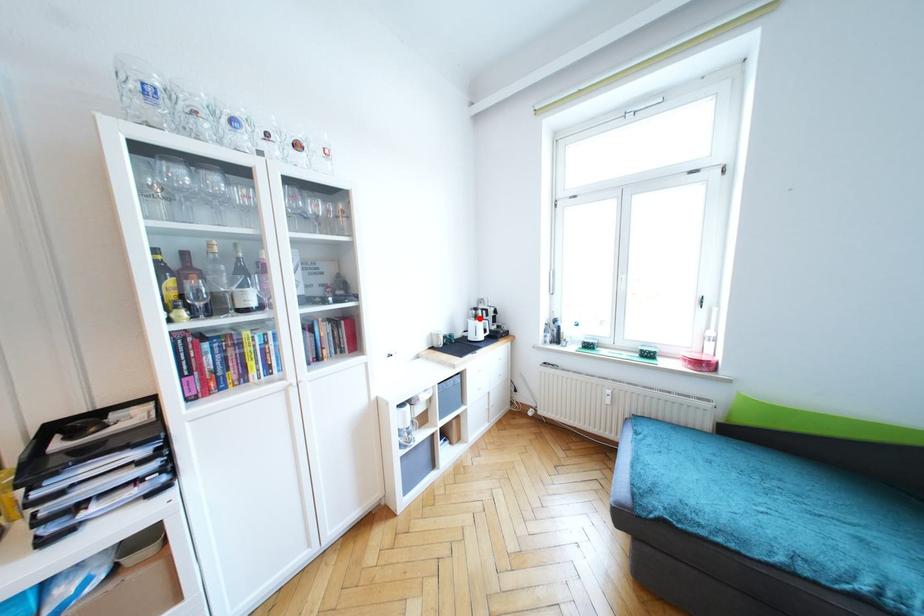
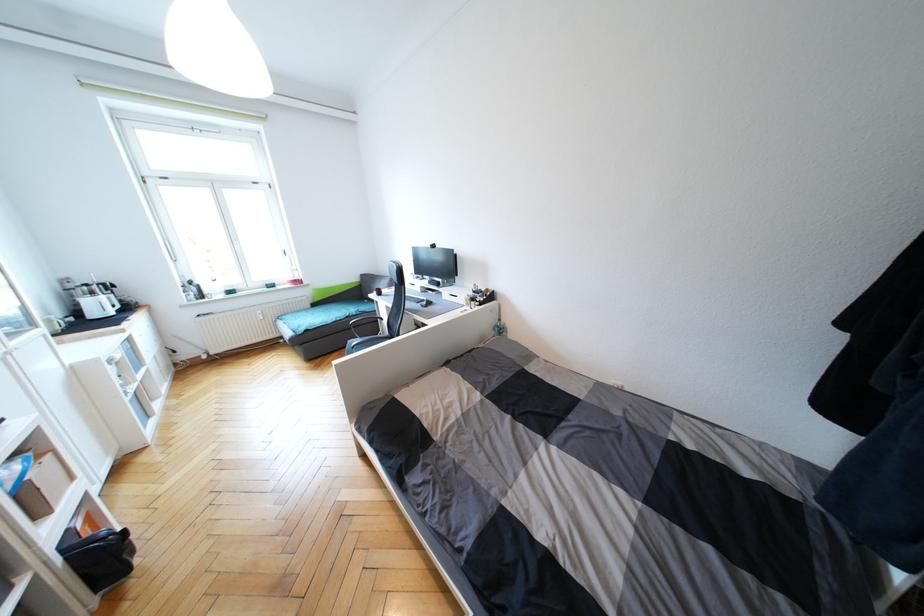
In the second image, find the point that corresponds to the highlighted location in the first image.

(95, 294)